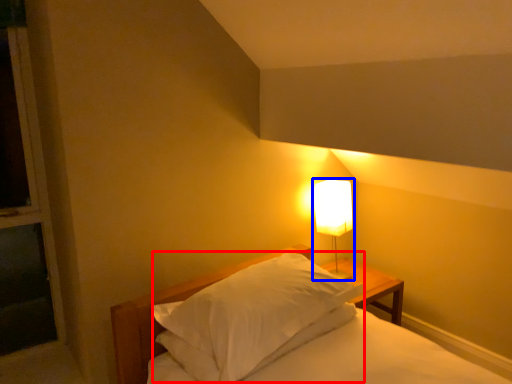
Question: Which object is further to the camera taking this photo, pillow (highlighted by a red box) or lamp (highlighted by a blue box)?

Choices:
 (A) pillow
 (B) lamp

Answer: (B)